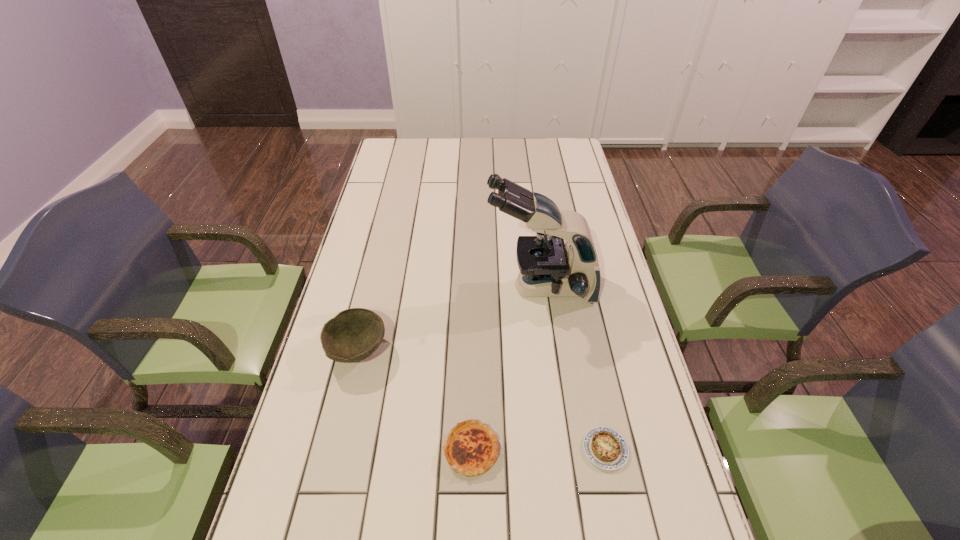
I want to click on free space at the far left corner of the desktop, so click(400, 163).

The height and width of the screenshot is (540, 960). What are the coordinates of `unoccupied position between the microscope and the bowl` in the screenshot? It's located at (448, 319).

Image resolution: width=960 pixels, height=540 pixels. I want to click on empty space between the right quiche and the second farthest object, so click(x=481, y=400).

Locate an element on the screen. vacant area that lies between the third tallest object and the right quiche is located at coordinates (539, 449).

Locate an element on the screen. vacant point located between the tallest object and the left quiche is located at coordinates (506, 369).

The height and width of the screenshot is (540, 960). In order to click on free point between the taller quiche and the shortest object in this screenshot , I will do `click(539, 449)`.

Locate an element on the screen. The height and width of the screenshot is (540, 960). free space between the tallest object and the shortest object is located at coordinates (573, 368).

I want to click on vacant space that's between the leftmost object and the taller quiche, so click(414, 400).

This screenshot has width=960, height=540. I want to click on free space between the shortest object and the third nearest object, so click(481, 400).

Locate an element on the screen. vacant area that lies between the microscope and the shorter quiche is located at coordinates (573, 368).